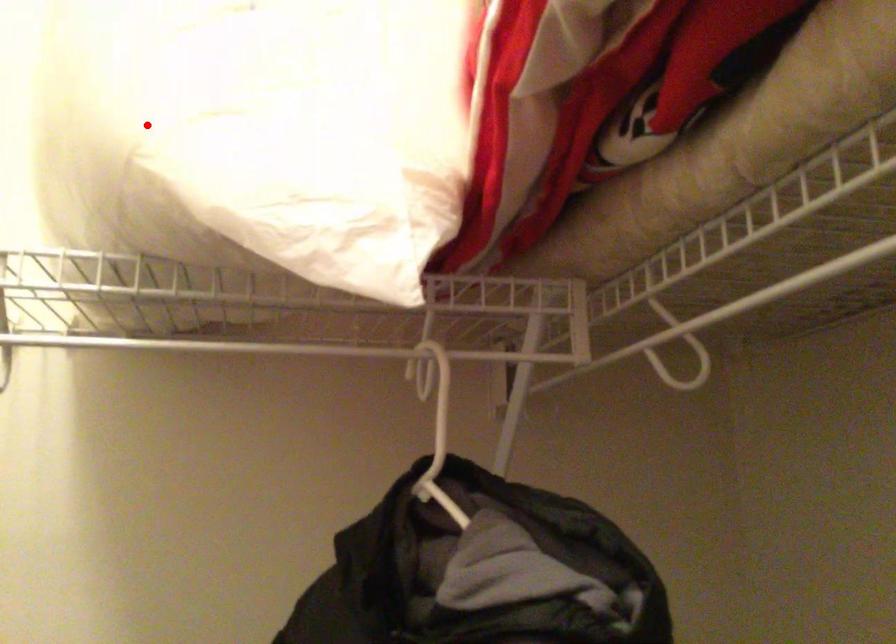
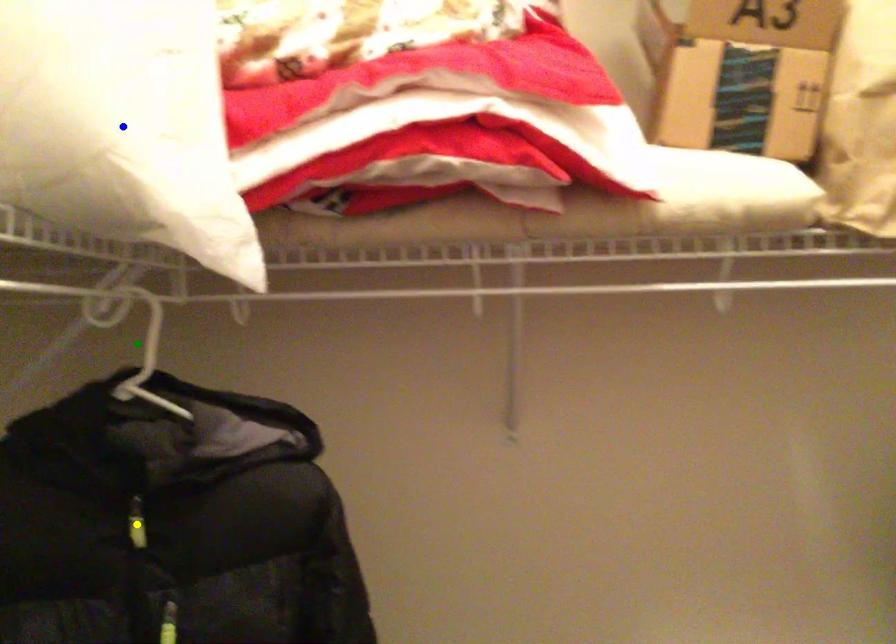
Question: I am providing you with two images of the same scene from different viewpoints. A red point is marked on the first image. You are given multiple points on the second image. Which point in image 2 is actually the same real-world point as the red point in image 1?

Choices:
 (A) blue point
 (B) green point
 (C) yellow point

Answer: (A)